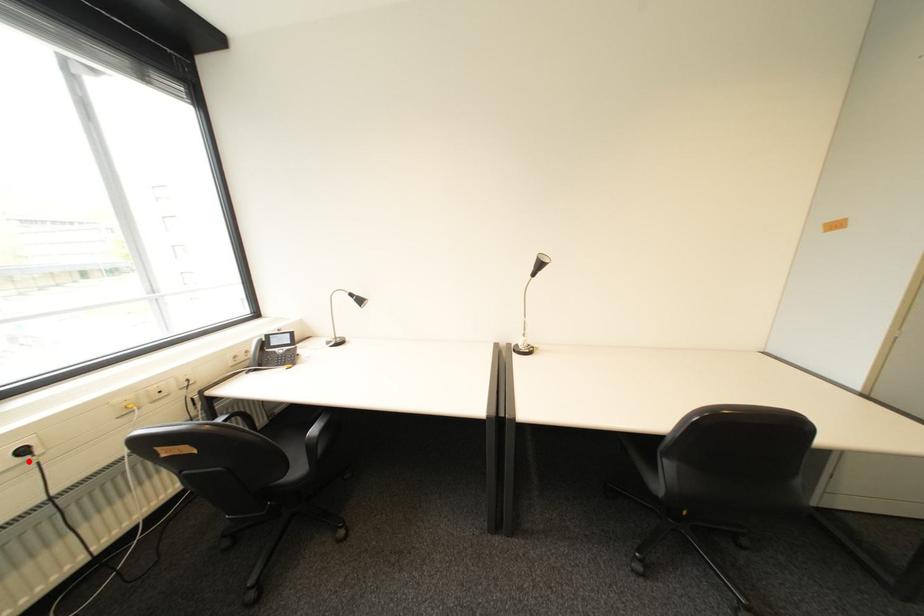
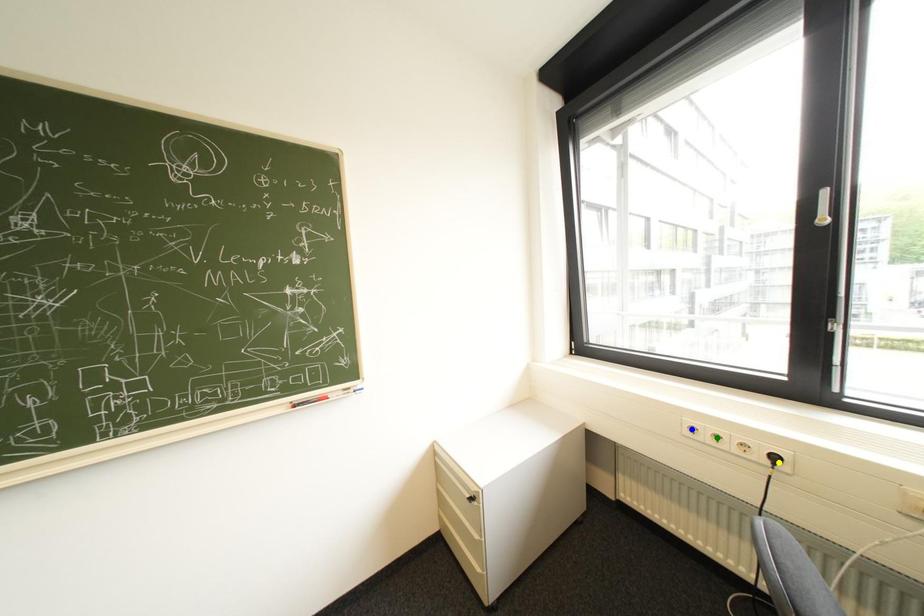
Question: I am providing you with two images of the same scene from different viewpoints. A red point is marked on the first image. You are given multiple points on the second image. Which point in image 2 is actually the same real-world point as the red point in image 1?

Choices:
 (A) yellow point
 (B) blue point
 (C) green point

Answer: (A)